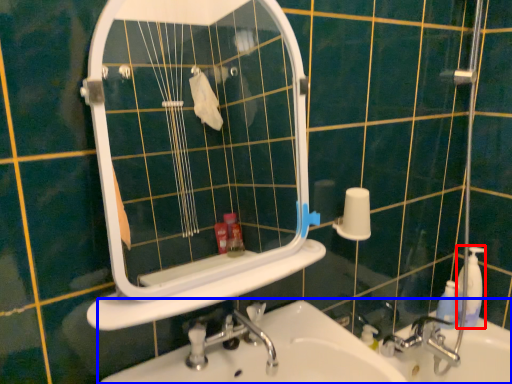
Question: Which point is further to the camera, soap dispenser (highlighted by a red box) or sink (highlighted by a blue box)?

Choices:
 (A) soap dispenser
 (B) sink

Answer: (A)